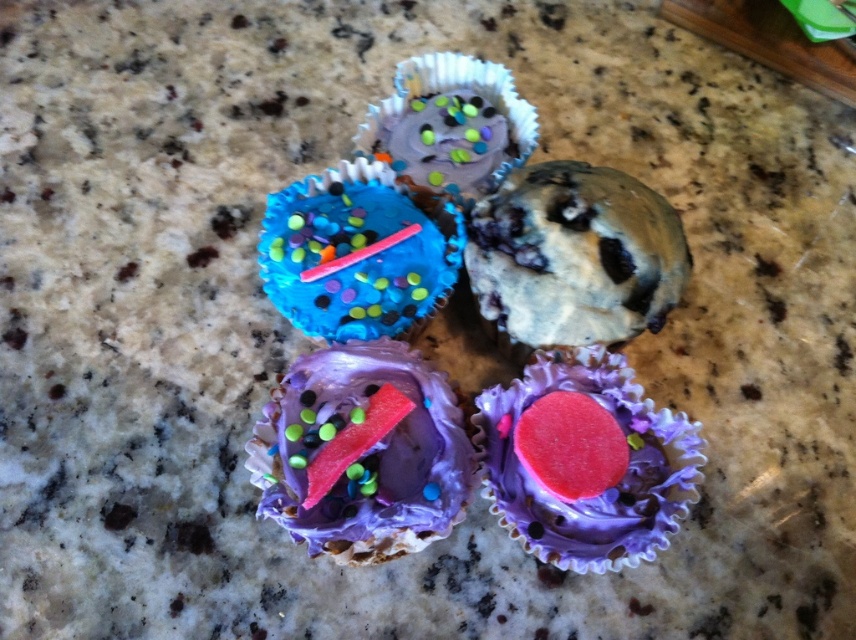
Is point (355, 529) positioned behind point (414, 102)?

That is False.

What do you see at coordinates (361, 452) in the screenshot?
I see `purple frosted cupcake with sprinkles and candy at center` at bounding box center [361, 452].

I want to click on purple frosted cupcake with sprinkles and candy at center, so click(361, 452).

Looking at this image, is chocolate chip cookie dough at upper center to the right of blue glossy cupcake at center-left from the viewer's perspective?

Indeed, chocolate chip cookie dough at upper center is positioned on the right side of blue glossy cupcake at center-left.

Is chocolate chip cookie dough at upper center wider than blue glossy cupcake at center-left?

Yes, chocolate chip cookie dough at upper center is wider than blue glossy cupcake at center-left.

Identify the location of chocolate chip cookie dough at upper center. The image size is (856, 640). (574, 256).

What do you see at coordinates (355, 253) in the screenshot?
I see `blue glossy cupcake at center-left` at bounding box center [355, 253].

Identify the location of blue glossy cupcake at center-left. (355, 253).

Find the location of a particular element. blue glossy cupcake at center-left is located at coordinates (355, 253).